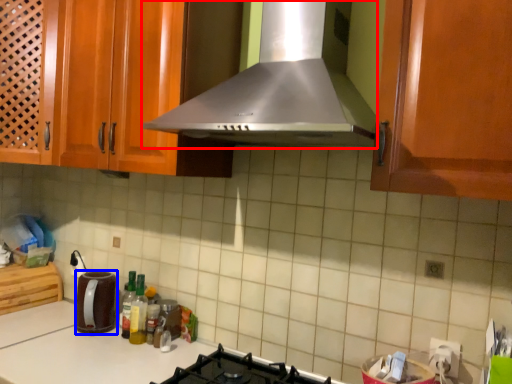
Question: Among these objects, which one is nearest to the camera, home appliance (highlighted by a red box) or kitchen appliance (highlighted by a blue box)?

Choices:
 (A) home appliance
 (B) kitchen appliance

Answer: (A)